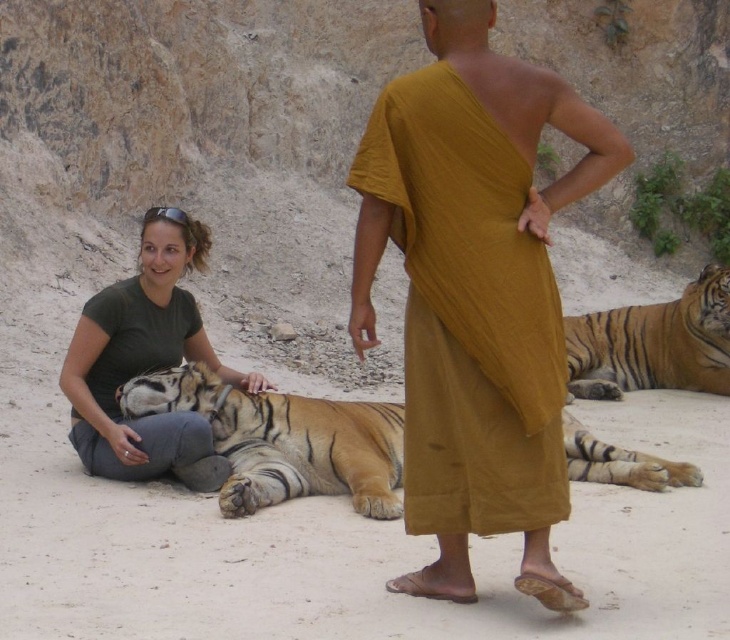
You are a visitor at the zoo and want to take a photo of the mustard fabric robe at center and the green matte shirt at lower left. Which one should you focus on first to ensure both are in the frame?

The mustard fabric robe at center is in front of the green matte shirt at lower left, so you should focus on the mustard fabric robe at center first to ensure both are in the frame.